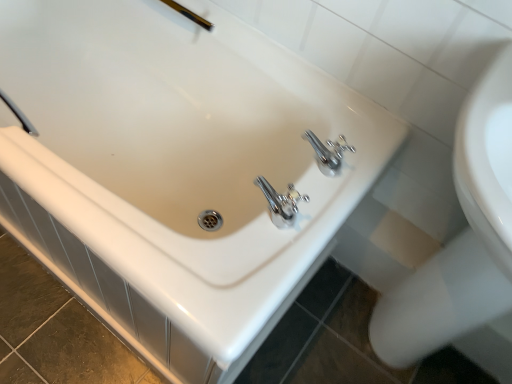
Question: Is white glossy sink at upper right positioned with its back to gold metallic shower head at upper center?

Choices:
 (A) yes
 (B) no

Answer: (B)

Question: Is white glossy sink at upper right bigger than gold metallic shower head at upper center?

Choices:
 (A) no
 (B) yes

Answer: (B)

Question: From a real-world perspective, is white glossy sink at upper right beneath gold metallic shower head at upper center?

Choices:
 (A) yes
 (B) no

Answer: (A)

Question: Considering the relative positions of white glossy sink at upper right and gold metallic shower head at upper center in the image provided, is white glossy sink at upper right to the right of gold metallic shower head at upper center from the viewer's perspective?

Choices:
 (A) no
 (B) yes

Answer: (B)

Question: Does white glossy sink at upper right have a greater width compared to gold metallic shower head at upper center?

Choices:
 (A) yes
 (B) no

Answer: (A)

Question: From the image's perspective, relative to gold metallic shower head at upper center, is white glossy sink at upper right above or below?

Choices:
 (A) below
 (B) above

Answer: (A)

Question: Visually, is white glossy sink at upper right positioned to the left or to the right of gold metallic shower head at upper center?

Choices:
 (A) right
 (B) left

Answer: (A)

Question: Which is correct: white glossy sink at upper right is inside gold metallic shower head at upper center, or outside of it?

Choices:
 (A) inside
 (B) outside

Answer: (B)

Question: From a real-world perspective, relative to gold metallic shower head at upper center, is white glossy sink at upper right vertically above or below?

Choices:
 (A) below
 (B) above

Answer: (A)

Question: Looking at their shapes, would you say white glossy bidet at lower right is wider or thinner than gold metallic shower head at upper center?

Choices:
 (A) wide
 (B) thin

Answer: (A)

Question: From the image's perspective, relative to gold metallic shower head at upper center, is white glossy bidet at lower right above or below?

Choices:
 (A) above
 (B) below

Answer: (B)

Question: Considering the positions of white glossy bidet at lower right and gold metallic shower head at upper center in the image, is white glossy bidet at lower right taller or shorter than gold metallic shower head at upper center?

Choices:
 (A) tall
 (B) short

Answer: (B)

Question: Is white glossy bidet at lower right situated inside gold metallic shower head at upper center or outside?

Choices:
 (A) inside
 (B) outside

Answer: (B)

Question: In terms of size, does gold metallic shower head at upper center appear bigger or smaller than white glossy sink at upper right?

Choices:
 (A) small
 (B) big

Answer: (A)

Question: In terms of height, does gold metallic shower head at upper center look taller or shorter compared to white glossy sink at upper right?

Choices:
 (A) tall
 (B) short

Answer: (B)